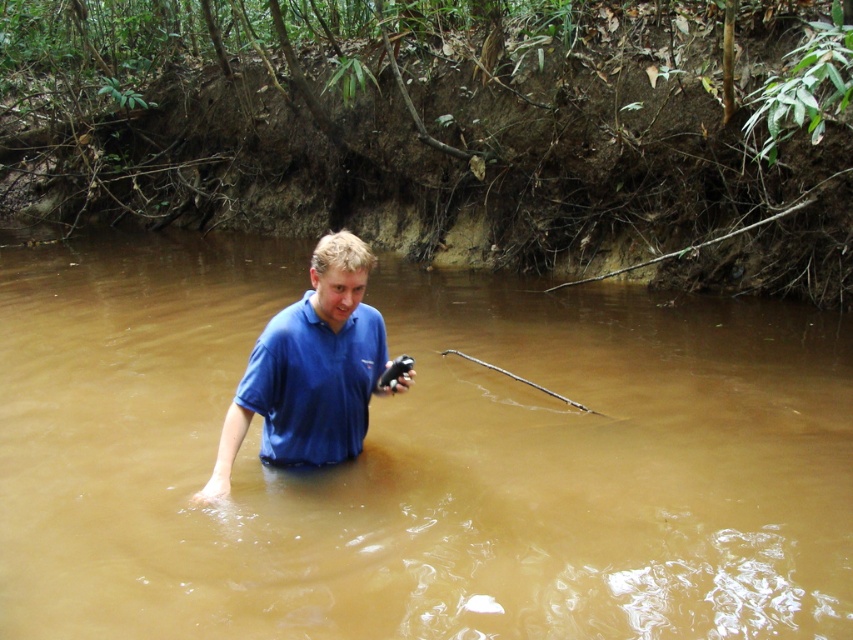
Question: Which of the following is the farthest from the observer?

Choices:
 (A) (341, 454)
 (B) (180, 616)

Answer: (A)

Question: Which point is farther from the camera taking this photo?

Choices:
 (A) (323, 358)
 (B) (786, 339)
 (C) (358, 317)

Answer: (B)

Question: Does brown muddy water at center have a smaller size compared to blue cotton polo shirt at center?

Choices:
 (A) no
 (B) yes

Answer: (A)

Question: Does blue matte shirt at center appear on the right side of blue cotton polo shirt at center?

Choices:
 (A) yes
 (B) no

Answer: (A)

Question: Which of the following is the farthest from the observer?

Choices:
 (A) (347, 342)
 (B) (331, 413)

Answer: (B)

Question: Can you confirm if brown muddy water at center is positioned to the right of blue cotton polo shirt at center?

Choices:
 (A) yes
 (B) no

Answer: (B)